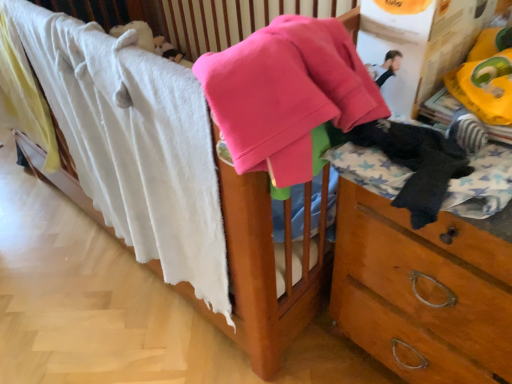
Question: Can you confirm if white soft towel at upper left is positioned to the right of black fuzzy socks at right?

Choices:
 (A) no
 (B) yes

Answer: (A)

Question: Can black fuzzy socks at right be found inside white soft towel at upper left?

Choices:
 (A) yes
 (B) no

Answer: (B)

Question: Is white soft towel at upper left shorter than black fuzzy socks at right?

Choices:
 (A) no
 (B) yes

Answer: (A)

Question: Is white soft towel at upper left positioned far away from black fuzzy socks at right?

Choices:
 (A) no
 (B) yes

Answer: (A)

Question: From a real-world perspective, is white soft towel at upper left below black fuzzy socks at right?

Choices:
 (A) no
 (B) yes

Answer: (B)

Question: Is black fuzzy socks at right taller or shorter than pink fleece sweater at upper center?

Choices:
 (A) short
 (B) tall

Answer: (A)

Question: Relative to pink fleece sweater at upper center, is black fuzzy socks at right in front or behind?

Choices:
 (A) front
 (B) behind

Answer: (B)

Question: In terms of size, does black fuzzy socks at right appear bigger or smaller than pink fleece sweater at upper center?

Choices:
 (A) big
 (B) small

Answer: (B)

Question: Is black fuzzy socks at right wider or thinner than pink fleece sweater at upper center?

Choices:
 (A) wide
 (B) thin

Answer: (B)

Question: In terms of size, does black fuzzy socks at right appear bigger or smaller than white soft towel at upper left?

Choices:
 (A) small
 (B) big

Answer: (A)

Question: Considering the positions of point (440, 150) and point (145, 220), is point (440, 150) closer or farther from the camera than point (145, 220)?

Choices:
 (A) farther
 (B) closer

Answer: (B)

Question: Considering the positions of black fuzzy socks at right and white soft towel at upper left in the image, is black fuzzy socks at right wider or thinner than white soft towel at upper left?

Choices:
 (A) thin
 (B) wide

Answer: (B)

Question: Would you say black fuzzy socks at right is to the left or to the right of white soft towel at upper left in the picture?

Choices:
 (A) left
 (B) right

Answer: (B)

Question: In the image, is pink fleece sweater at upper center on the left side or the right side of white soft towel at upper left?

Choices:
 (A) left
 (B) right

Answer: (B)

Question: Is pink fleece sweater at upper center taller or shorter than white soft towel at upper left?

Choices:
 (A) tall
 (B) short

Answer: (B)